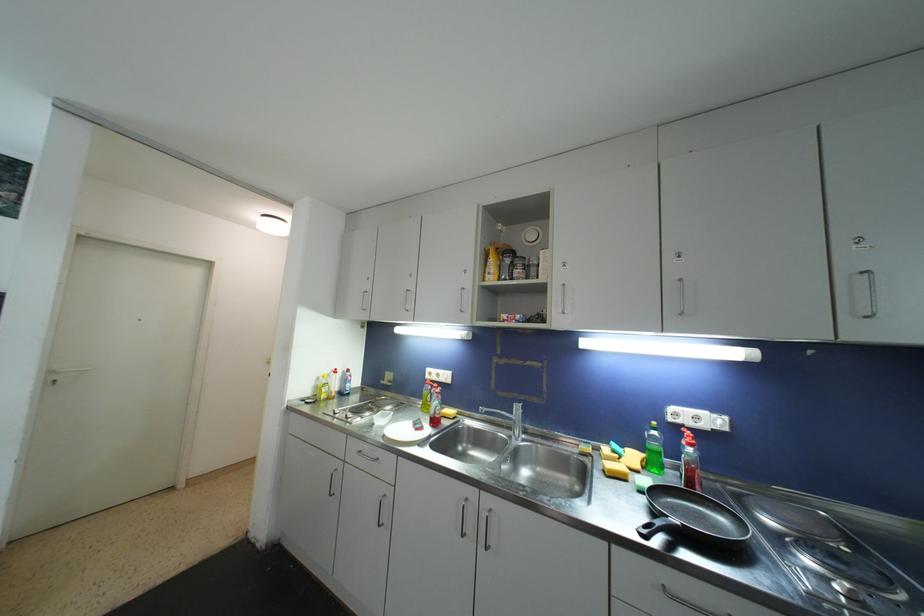
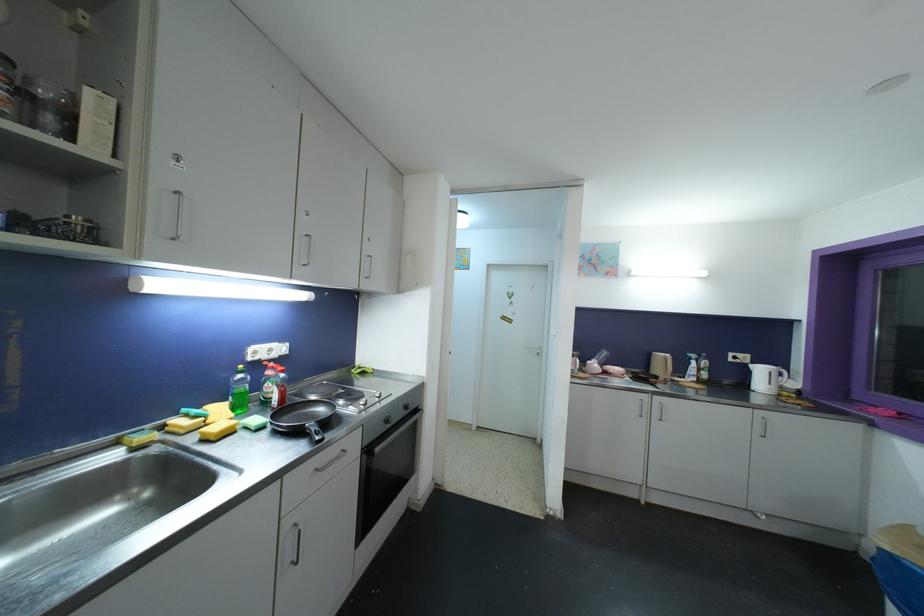
The point at [658,436] is marked in the first image. Where is the corresponding point in the second image?

(244, 379)